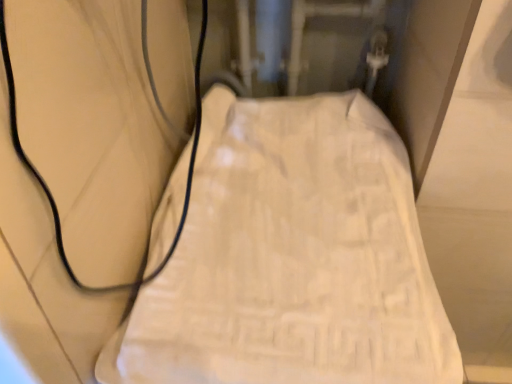
Question: In terms of height, does white textured towel at center look taller or shorter compared to black rubber wire at left?

Choices:
 (A) tall
 (B) short

Answer: (A)

Question: Considering their positions, is white textured towel at center located in front of or behind black rubber wire at left?

Choices:
 (A) front
 (B) behind

Answer: (B)

Question: Considering the relative positions of white textured towel at center and black rubber wire at left in the image provided, is white textured towel at center to the left or to the right of black rubber wire at left?

Choices:
 (A) left
 (B) right

Answer: (B)

Question: Is black rubber wire at left bigger or smaller than white textured towel at center?

Choices:
 (A) small
 (B) big

Answer: (A)

Question: Is black rubber wire at left wider or thinner than white textured towel at center?

Choices:
 (A) wide
 (B) thin

Answer: (B)

Question: Based on their positions, is black rubber wire at left located to the left or right of white textured towel at center?

Choices:
 (A) right
 (B) left

Answer: (B)

Question: Considering their positions, is black rubber wire at left located in front of or behind white textured towel at center?

Choices:
 (A) behind
 (B) front

Answer: (B)